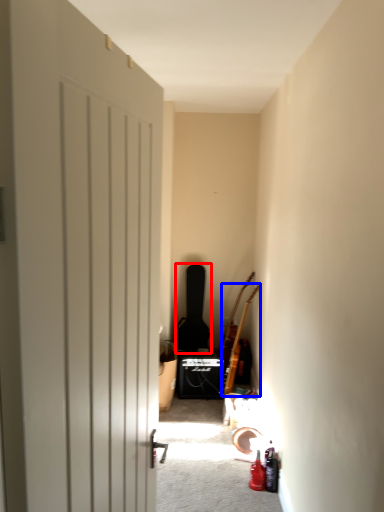
Question: Among these objects, which one is nearest to the camera, guitar (highlighted by a red box) or guitar (highlighted by a blue box)?

Choices:
 (A) guitar
 (B) guitar

Answer: (B)